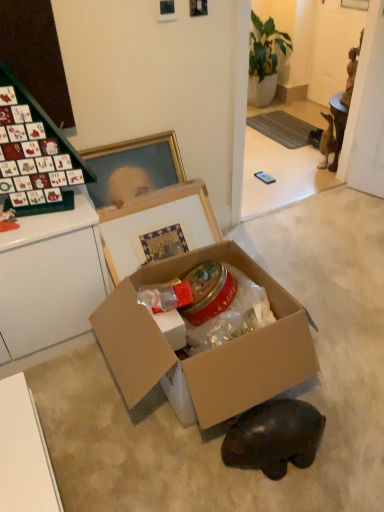
Find the location of a particular element. This screenshot has width=384, height=512. green glossy plant at upper center is located at coordinates (265, 60).

In order to face shiny black bear at lower center, which is the second animal from top to bottom, should I rotate leftwards or rightwards?

It's best to rotate right around 11.538 degrees.

The width and height of the screenshot is (384, 512). In order to click on green glossy plant at upper center in this screenshot , I will do `click(265, 60)`.

Consider the image. Would you say brown matte figurine at right, marked as the 1th animal in a top-to-bottom arrangement, is outside shiny black bear at lower center, the 2th animal from the right?

Absolutely, brown matte figurine at right, marked as the 1th animal in a top-to-bottom arrangement, is external to shiny black bear at lower center, the 2th animal from the right.

The height and width of the screenshot is (512, 384). In order to click on animal in front of the brown matte figurine at right, the 1th animal when ordered from back to front in this screenshot , I will do `click(274, 437)`.

Between brown matte figurine at right, which is the first animal from right to left, and shiny black bear at lower center, the first animal from the front, which one is positioned in front?

Positioned in front is shiny black bear at lower center, the first animal from the front.

Does brown matte figurine at right, marked as the 1th animal in a top-to-bottom arrangement, turn towards shiny black bear at lower center, placed as the first animal when sorted from bottom to top?

No, brown matte figurine at right, marked as the 1th animal in a top-to-bottom arrangement, does not turn towards shiny black bear at lower center, placed as the first animal when sorted from bottom to top.

Is brown matte figurine at right, the second animal viewed from the front, turned away from green glossy plant at upper center?

No, brown matte figurine at right, the second animal viewed from the front, is not facing the opposite direction of green glossy plant at upper center.

Identify the location of houseplant that is above the brown matte figurine at right, which is the 2th animal from left to right (from the image's perspective). (265, 60).

From the picture: Is brown matte figurine at right, the 1th animal when ordered from back to front, surrounding green glossy plant at upper center?

Definitely not — green glossy plant at upper center is not inside brown matte figurine at right, the 1th animal when ordered from back to front.

What's the angular difference between brown matte figurine at right, the 2th animal positioned from the bottom, and green glossy plant at upper center's facing directions?

25.5 degrees separate the facing orientations of brown matte figurine at right, the 2th animal positioned from the bottom, and green glossy plant at upper center.

From the image's perspective, which is below, brown matte figurine at right, which is the first animal from right to left, or cardboard box at center?

cardboard box at center appears lower in the image.

Which object is thinner, brown matte figurine at right, the 2th animal positioned from the bottom, or cardboard box at center?

brown matte figurine at right, the 2th animal positioned from the bottom, is thinner.

Is point (326, 146) positioned behind point (114, 376)?

Yes, point (326, 146) is farther from viewer.

How much distance is there between brown matte figurine at right, which is the 2th animal from left to right, and cardboard box at center?

They are 6.21 feet apart.

Looking at this image, is shiny black bear at lower center, the 2th animal from the right, oriented towards brown matte figurine at right, marked as the 1th animal in a top-to-bottom arrangement?

No, shiny black bear at lower center, the 2th animal from the right, is not turned towards brown matte figurine at right, marked as the 1th animal in a top-to-bottom arrangement.

Based on their sizes in the image, would you say shiny black bear at lower center, which appears as the 1th animal when viewed from the left, is bigger or smaller than brown matte figurine at right, the 2th animal positioned from the bottom?

In the image, shiny black bear at lower center, which appears as the 1th animal when viewed from the left, appears to be larger than brown matte figurine at right, the 2th animal positioned from the bottom.

From the picture: Is shiny black bear at lower center, placed as the first animal when sorted from bottom to top, thinner than brown matte figurine at right, the second animal viewed from the front?

No.

From the image's perspective, which one is positioned lower, shiny black bear at lower center, the 2th animal from the right, or brown matte figurine at right, which is the first animal from right to left?

shiny black bear at lower center, the 2th animal from the right.

Considering the relative sizes of green glossy plant at upper center and shiny black bear at lower center, placed as the first animal when sorted from bottom to top, in the image provided, is green glossy plant at upper center smaller than shiny black bear at lower center, placed as the first animal when sorted from bottom to top,?

Incorrect, green glossy plant at upper center is not smaller in size than shiny black bear at lower center, placed as the first animal when sorted from bottom to top.

Which of these two, green glossy plant at upper center or shiny black bear at lower center, the first animal from the front, stands shorter?

With less height is shiny black bear at lower center, the first animal from the front.

Between green glossy plant at upper center and shiny black bear at lower center, which is counted as the 2th animal, starting from the back, which one appears on the right side from the viewer's perspective?

From the viewer's perspective, green glossy plant at upper center appears more on the right side.

From the image's perspective, which is below, green glossy plant at upper center or shiny black bear at lower center, the 2th animal from the right?

shiny black bear at lower center, the 2th animal from the right, from the image's perspective.

Is point (285, 338) closer or farther from the camera than point (298, 458)?

Point (285, 338).

From the picture: Does cardboard box at center have a larger size compared to shiny black bear at lower center, placed as the first animal when sorted from bottom to top?

Correct, cardboard box at center is larger in size than shiny black bear at lower center, placed as the first animal when sorted from bottom to top.

Consider the image. From a real-world perspective, is cardboard box at center on top of shiny black bear at lower center, which is counted as the 2th animal, starting from the back?

Indeed, from a real-world perspective, cardboard box at center stands above shiny black bear at lower center, which is counted as the 2th animal, starting from the back.

Does cardboard box at center have a greater height compared to shiny black bear at lower center, which is counted as the 2th animal, starting from the back?

Indeed, cardboard box at center has a greater height compared to shiny black bear at lower center, which is counted as the 2th animal, starting from the back.

Which is more to the left, shiny black bear at lower center, the 2th animal from the right, or cardboard box at center?

From the viewer's perspective, cardboard box at center appears more on the left side.

Consider the image. Considering the sizes of objects shiny black bear at lower center, placed as the first animal when sorted from bottom to top, and cardboard box at center in the image provided, who is thinner, shiny black bear at lower center, placed as the first animal when sorted from bottom to top, or cardboard box at center?

Thinner between the two is cardboard box at center.

Would you say shiny black bear at lower center, the first animal from the front, is inside or outside cardboard box at center?

shiny black bear at lower center, the first animal from the front, lies outside cardboard box at center.

Is shiny black bear at lower center, which appears as the 1th animal when viewed from the left, in contact with cardboard box at center?

shiny black bear at lower center, which appears as the 1th animal when viewed from the left, and cardboard box at center are not in contact.

The width and height of the screenshot is (384, 512). I want to click on animal behind the shiny black bear at lower center, the 2th animal from the right, so click(x=327, y=141).

The height and width of the screenshot is (512, 384). Identify the location of houseplant that is on the left side of brown matte figurine at right, which is the first animal from right to left. [x=265, y=60].

Looking at this image, from the image, which object appears to be farther from shiny black bear at lower center, which is counted as the 2th animal, starting from the back, cardboard box at center or green glossy plant at upper center?

green glossy plant at upper center is further to shiny black bear at lower center, which is counted as the 2th animal, starting from the back.

Which object lies nearer to the anchor point cardboard box at center, green glossy plant at upper center or shiny black bear at lower center, the first animal from the front?

Based on the image, shiny black bear at lower center, the first animal from the front, appears to be nearer to cardboard box at center.

Looking at the image, which one is located further to cardboard box at center, brown matte figurine at right, the second animal viewed from the front, or green glossy plant at upper center?

green glossy plant at upper center lies further to cardboard box at center than the other object.

From the image, which object appears to be nearer to shiny black bear at lower center, the first animal from the front, cardboard box at center or cardboard box at center?

cardboard box at center.

When comparing their distances from cardboard box at center, does green glossy plant at upper center or brown matte figurine at right, the second animal viewed from the front, seem further?

green glossy plant at upper center.

Considering their positions, is green glossy plant at upper center positioned further to cardboard box at center than brown matte figurine at right, which is the 2th animal from left to right?

The object further to cardboard box at center is green glossy plant at upper center.

When comparing their distances from brown matte figurine at right, which is the 2th animal from left to right, does cardboard box at center or shiny black bear at lower center, which is counted as the 2th animal, starting from the back, seem closer?

The object closer to brown matte figurine at right, which is the 2th animal from left to right, is cardboard box at center.

Estimate the real-world distances between objects in this image. Which object is closer to cardboard box at center, brown matte figurine at right, which is the 2th animal from left to right, or green glossy plant at upper center?

brown matte figurine at right, which is the 2th animal from left to right, is positioned closer to the anchor cardboard box at center.

You are a GUI agent. You are given a task and a screenshot of the screen. Output one action in this format:
    pyautogui.click(x=<x>, y=<y>)
    Task: Click on the animal located between cardboard box at center and brown matte figurine at right, the 1th animal when ordered from back to front, in the depth direction
    The image size is (384, 512).
    Given the screenshot: What is the action you would take?
    pyautogui.click(x=274, y=437)

Locate an element on the screen. The width and height of the screenshot is (384, 512). box between green glossy plant at upper center and shiny black bear at lower center, which is the second animal from top to bottom, in the up-down direction is located at coordinates (206, 351).

Where is `box between cardboard box at center and shiny black bear at lower center, the 2th animal from the right, vertically`? The height and width of the screenshot is (512, 384). box between cardboard box at center and shiny black bear at lower center, the 2th animal from the right, vertically is located at coordinates (206, 351).

Where is `cardboard box positioned between shiny black bear at lower center, the 2th animal from the right, and brown matte figurine at right, which is the 2th animal from left to right, from near to far`? This screenshot has height=512, width=384. cardboard box positioned between shiny black bear at lower center, the 2th animal from the right, and brown matte figurine at right, which is the 2th animal from left to right, from near to far is located at coordinates (156, 224).